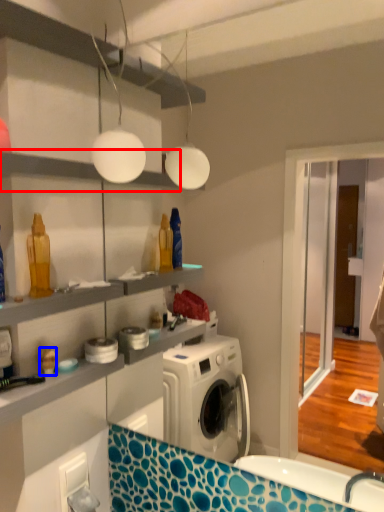
Question: Which point is further to the camera, shelf (highlighted by a red box) or toy (highlighted by a blue box)?

Choices:
 (A) shelf
 (B) toy

Answer: (B)